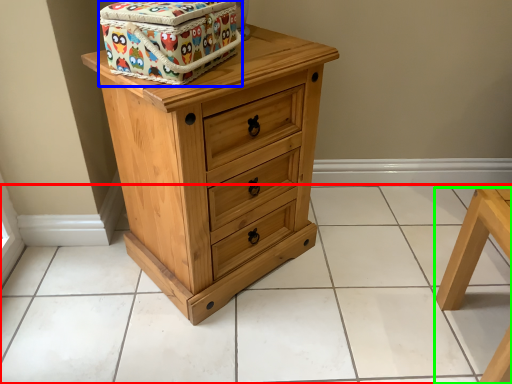
Question: Estimate the real-world distances between objects in this image. Which object is closer to tile (highlighted by a red box), cardboard box (highlighted by a blue box) or furniture (highlighted by a green box)?

Choices:
 (A) cardboard box
 (B) furniture

Answer: (B)